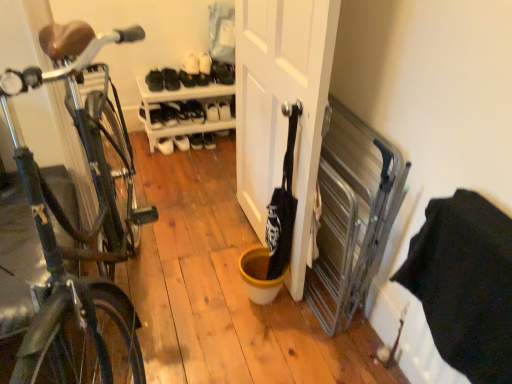
You are a GUI agent. You are given a task and a screenshot of the screen. Output one action in this format:
    pyautogui.click(x=<x>, y=<y>)
    Task: Click on the free space to the left of yellow matte bucket at center
    This screenshot has width=512, height=384.
    Given the screenshot: What is the action you would take?
    pyautogui.click(x=211, y=290)